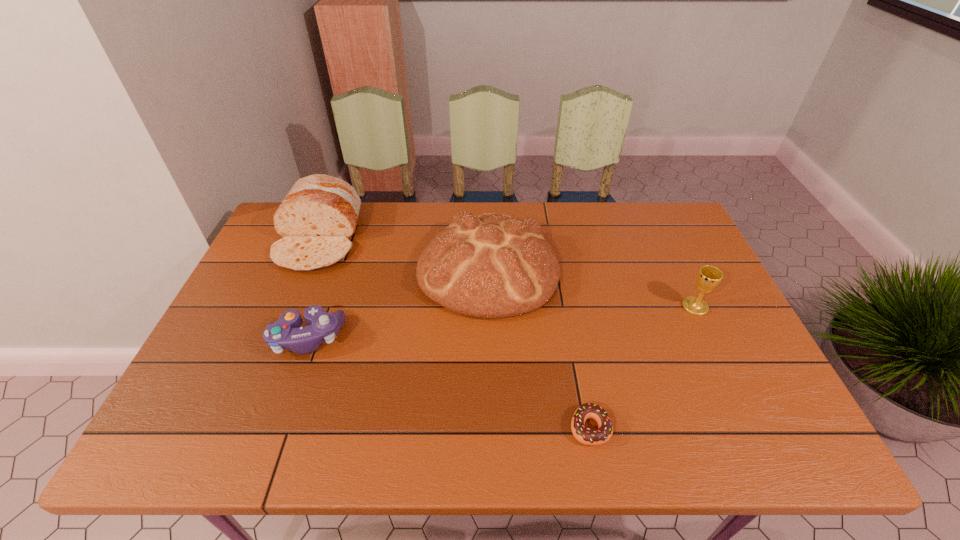
Locate an element on the screen. The image size is (960, 540). vacant region at the near right corner is located at coordinates (755, 435).

Where is `vacant region between the fourth tallest object and the third shortest object`? vacant region between the fourth tallest object and the third shortest object is located at coordinates (501, 322).

Locate an element on the screen. This screenshot has width=960, height=540. unoccupied position between the second shortest object and the third shortest object is located at coordinates (501, 322).

Locate an element on the screen. The image size is (960, 540). empty space between the control and the right bread is located at coordinates (397, 303).

Find the location of `vacant area between the second shortest object and the rightmost object`. vacant area between the second shortest object and the rightmost object is located at coordinates (501, 322).

Image resolution: width=960 pixels, height=540 pixels. In order to click on vacant area between the control and the shortest object in this screenshot , I will do `click(448, 383)`.

Locate an element on the screen. The image size is (960, 540). empty space that is in between the right bread and the rightmost object is located at coordinates (591, 288).

What are the coordinates of `blank region between the right bread and the nearest object` in the screenshot? It's located at (539, 348).

At what (x,y) coordinates should I click in order to perform the action: click on free area in between the shortest object and the left bread. Please return your answer as a coordinate pair (x, y). The height and width of the screenshot is (540, 960). Looking at the image, I should click on (454, 333).

Locate an element on the screen. The width and height of the screenshot is (960, 540). free area in between the right bread and the left bread is located at coordinates (403, 254).